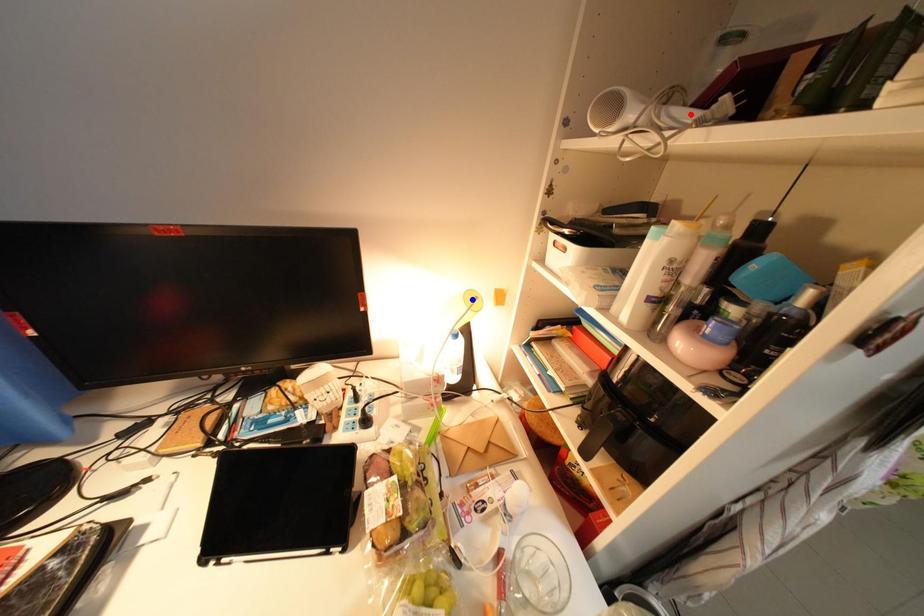
Question: Two points are marked on the image. Which point is closer to the camera?

Choices:
 (A) Blue point is closer.
 (B) Red point is closer.

Answer: (B)